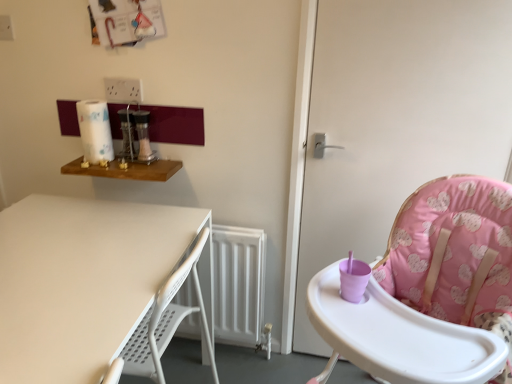
Question: Is pink fabric highchair at right at the back of pink fabric high chair at right?

Choices:
 (A) yes
 (B) no

Answer: (A)

Question: From the image's perspective, would you say pink fabric high chair at right is shown under pink fabric highchair at right?

Choices:
 (A) no
 (B) yes

Answer: (A)

Question: From the image's perspective, is pink fabric high chair at right on top of pink fabric highchair at right?

Choices:
 (A) no
 (B) yes

Answer: (B)

Question: Is pink fabric high chair at right touching pink fabric highchair at right?

Choices:
 (A) no
 (B) yes

Answer: (A)

Question: Is pink fabric high chair at right facing towards pink fabric highchair at right?

Choices:
 (A) yes
 (B) no

Answer: (A)

Question: Can you confirm if pink fabric high chair at right is bigger than pink fabric highchair at right?

Choices:
 (A) yes
 (B) no

Answer: (B)

Question: Does white paper towel at upper left have a larger size compared to pink fabric high chair at right?

Choices:
 (A) no
 (B) yes

Answer: (A)

Question: Is white paper towel at upper left shorter than pink fabric high chair at right?

Choices:
 (A) yes
 (B) no

Answer: (A)

Question: Is white paper towel at upper left beside pink fabric high chair at right?

Choices:
 (A) yes
 (B) no

Answer: (B)

Question: Is white paper towel at upper left oriented towards pink fabric high chair at right?

Choices:
 (A) no
 (B) yes

Answer: (A)

Question: Is white paper towel at upper left at the right side of pink fabric high chair at right?

Choices:
 (A) no
 (B) yes

Answer: (A)

Question: Is white paper towel at upper left positioned behind pink fabric high chair at right?

Choices:
 (A) yes
 (B) no

Answer: (A)

Question: Does pink fabric high chair at right have a larger size compared to white paper towel at upper left?

Choices:
 (A) no
 (B) yes

Answer: (B)